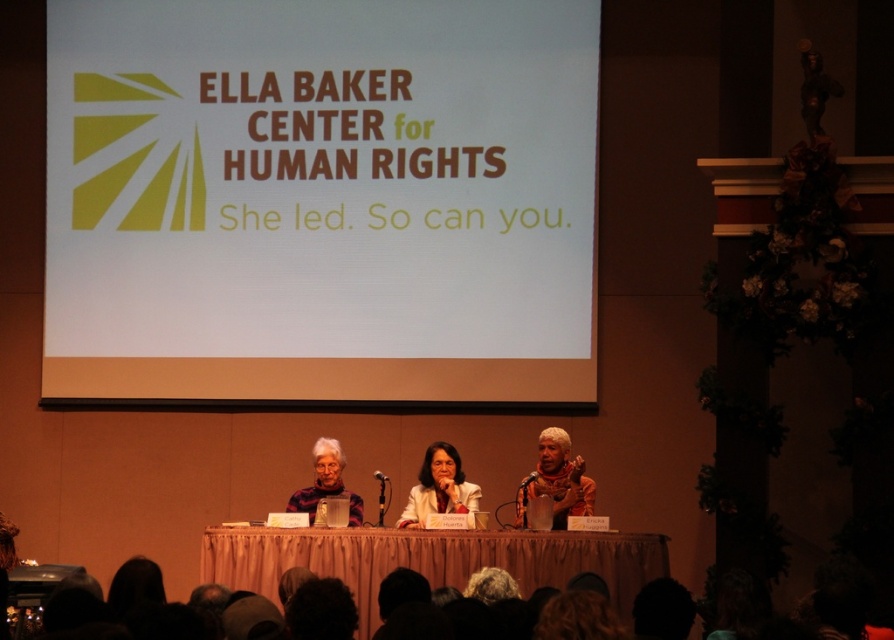
You are organizing a panel discussion and need to place a large banner on the table. The banner is the size of the white paper at center. Will it fit on the smooth beige table at center?

The white paper at center is bigger than the smooth beige table at center, so the banner will not fit on the table.

You are attending the panel discussion at the Ella Baker Center for Human Rights and notice two items on the table in front of you. One is a silky brown scarf at center and the other is a matte black sweater at center. Which item is taller?

The silky brown scarf at center is taller than the matte black sweater at center.